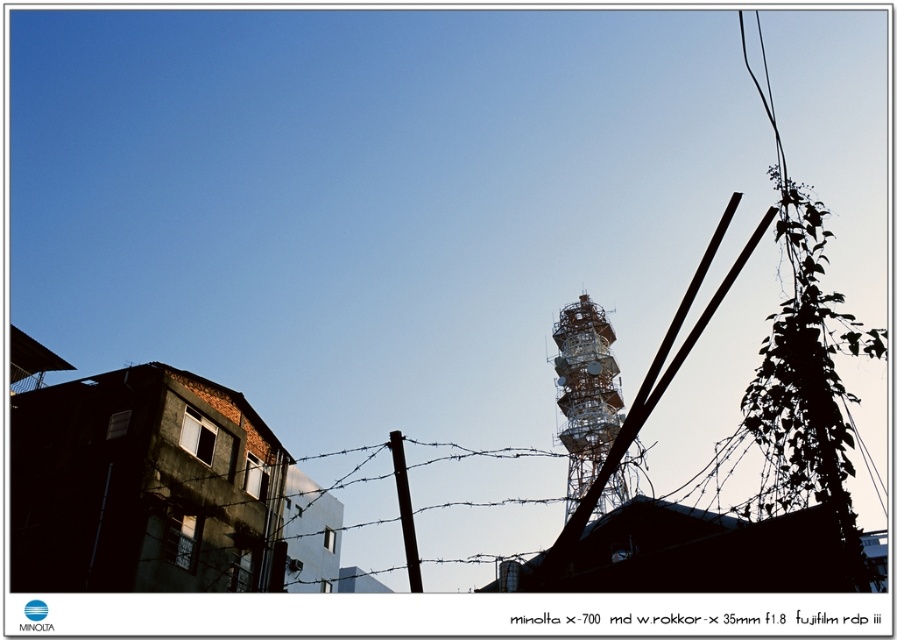
Who is positioned more to the left, metallic lattice tower at center or black matte telegraph pole at center?

From the viewer's perspective, black matte telegraph pole at center appears more on the left side.

Is point (606, 371) closer to camera compared to point (410, 540)?

That is False.

This screenshot has height=640, width=897. Find the location of `metallic lattice tower at center`. metallic lattice tower at center is located at coordinates 585,392.

The width and height of the screenshot is (897, 640). Find the location of `metallic lattice tower at center`. metallic lattice tower at center is located at coordinates (585, 392).